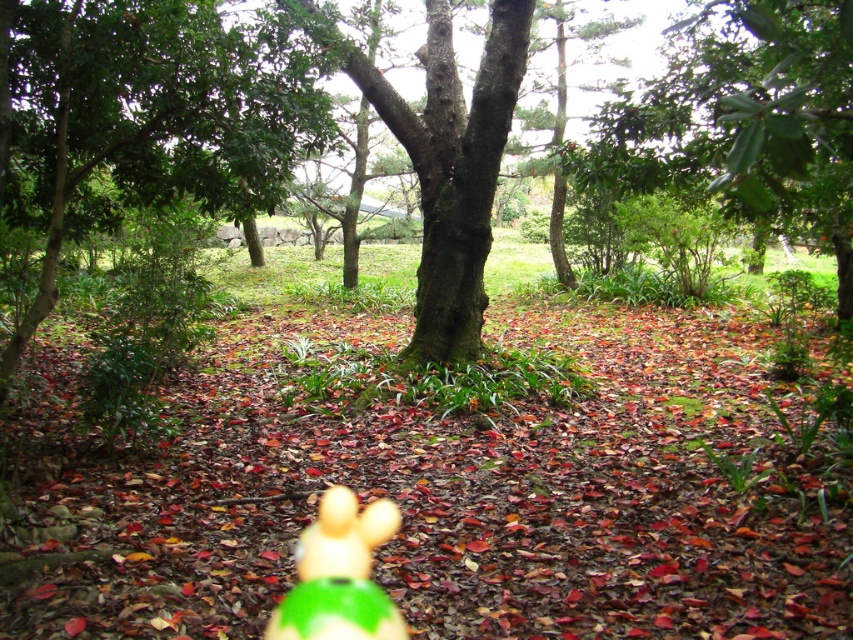
Can you confirm if green mossy tree at center is positioned to the left of green matte toy at center?

Incorrect, green mossy tree at center is not on the left side of green matte toy at center.

Does green mossy tree at center come in front of green matte toy at center?

No, green mossy tree at center is further to the viewer.

Is point (437, 189) more distant than point (364, 600)?

Yes, it is.

Where is `green mossy tree at center`? The height and width of the screenshot is (640, 853). green mossy tree at center is located at coordinates (444, 161).

Which is behind, point (114, 12) or point (796, 104)?

Positioned behind is point (114, 12).

Is point (167, 68) more distant than point (814, 3)?

Yes, it is.

You are a GUI agent. You are given a task and a screenshot of the screen. Output one action in this format:
    pyautogui.click(x=<x>, y=<y>)
    Task: Click on the green leafy tree at center
    The width and height of the screenshot is (853, 640).
    Given the screenshot: What is the action you would take?
    (x=149, y=115)

Looking at this image, who is positioned more to the right, green leafy tree at upper right or green mossy tree at center?

From the viewer's perspective, green leafy tree at upper right appears more on the right side.

Is green leafy tree at upper right further to the viewer compared to green mossy tree at center?

No.

Identify the location of green leafy tree at upper right. This screenshot has width=853, height=640. (746, 122).

Where is `green leafy tree at upper right`? The image size is (853, 640). green leafy tree at upper right is located at coordinates (746, 122).